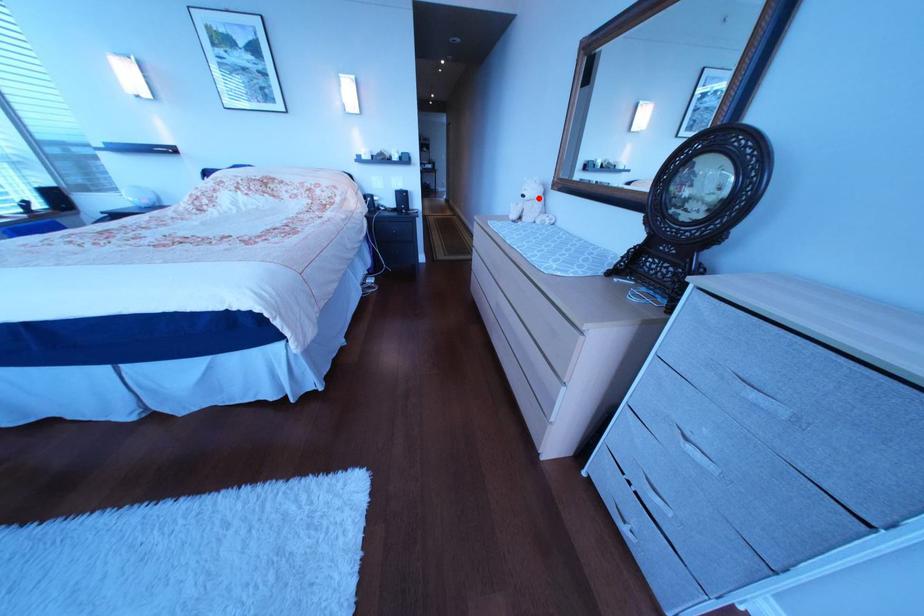
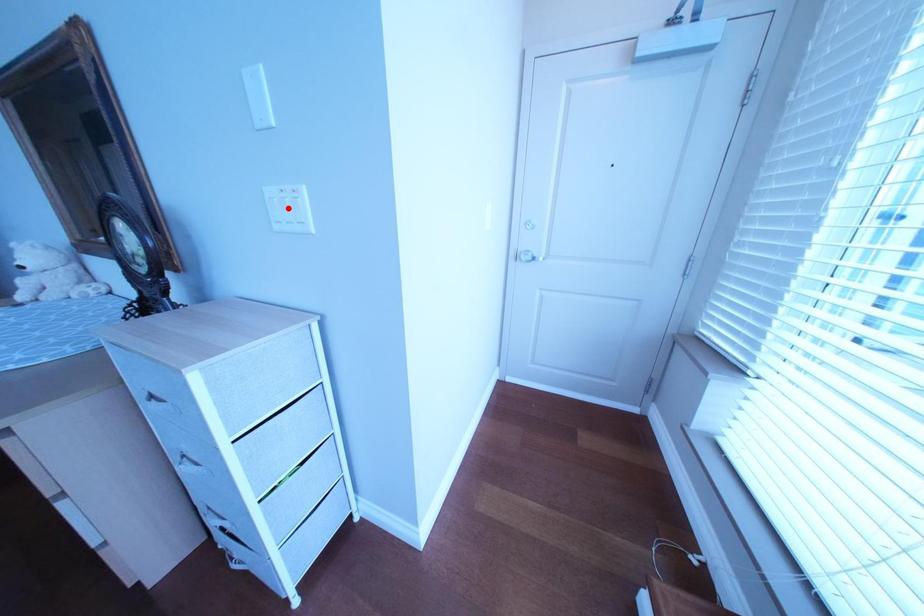
I am providing you with two images of the same scene from different viewpoints. A red point is marked on the first image and another point is marked on the second image. Is the marked point in image1 the same physical position as the marked point in image2?

No